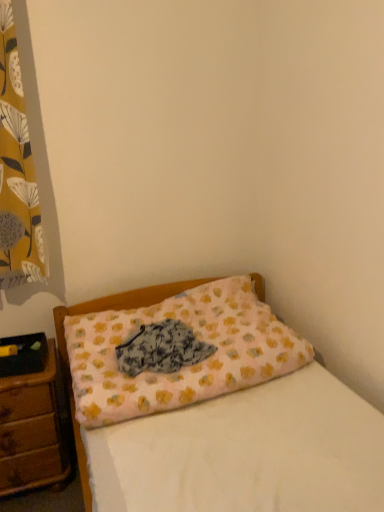
Question: Is pink fabric pillow at center located within brown wooden nightstand at lower left?

Choices:
 (A) yes
 (B) no

Answer: (B)

Question: Considering the relative sizes of brown wooden nightstand at lower left and pink fabric pillow at center in the image provided, is brown wooden nightstand at lower left bigger than pink fabric pillow at center?

Choices:
 (A) no
 (B) yes

Answer: (A)

Question: Does brown wooden nightstand at lower left have a lesser width compared to pink fabric pillow at center?

Choices:
 (A) no
 (B) yes

Answer: (B)

Question: Can you confirm if brown wooden nightstand at lower left is positioned to the left of pink fabric pillow at center?

Choices:
 (A) yes
 (B) no

Answer: (A)

Question: From the image's perspective, would you say brown wooden nightstand at lower left is positioned over pink fabric pillow at center?

Choices:
 (A) yes
 (B) no

Answer: (B)

Question: Considering the positions of fluffy fabric at center and brown wooden nightstand at lower left in the image, is fluffy fabric at center wider or thinner than brown wooden nightstand at lower left?

Choices:
 (A) thin
 (B) wide

Answer: (A)

Question: Considering their positions, is fluffy fabric at center located in front of or behind brown wooden nightstand at lower left?

Choices:
 (A) front
 (B) behind

Answer: (A)

Question: Based on their sizes in the image, would you say fluffy fabric at center is bigger or smaller than brown wooden nightstand at lower left?

Choices:
 (A) small
 (B) big

Answer: (A)

Question: Is fluffy fabric at center taller or shorter than brown wooden nightstand at lower left?

Choices:
 (A) tall
 (B) short

Answer: (B)

Question: Does point (3, 494) appear closer or farther from the camera than point (14, 137)?

Choices:
 (A) closer
 (B) farther

Answer: (B)

Question: Visually, is brown wooden nightstand at lower left positioned to the left or to the right of yellow floral fabric at left?

Choices:
 (A) left
 (B) right

Answer: (B)

Question: Considering the positions of brown wooden nightstand at lower left and yellow floral fabric at left in the image, is brown wooden nightstand at lower left wider or thinner than yellow floral fabric at left?

Choices:
 (A) wide
 (B) thin

Answer: (A)

Question: In terms of height, does brown wooden nightstand at lower left look taller or shorter compared to yellow floral fabric at left?

Choices:
 (A) short
 (B) tall

Answer: (A)

Question: From a real-world perspective, is yellow floral fabric at left above or below brown wooden nightstand at lower left?

Choices:
 (A) below
 (B) above

Answer: (B)

Question: In terms of width, does yellow floral fabric at left look wider or thinner when compared to brown wooden nightstand at lower left?

Choices:
 (A) wide
 (B) thin

Answer: (B)